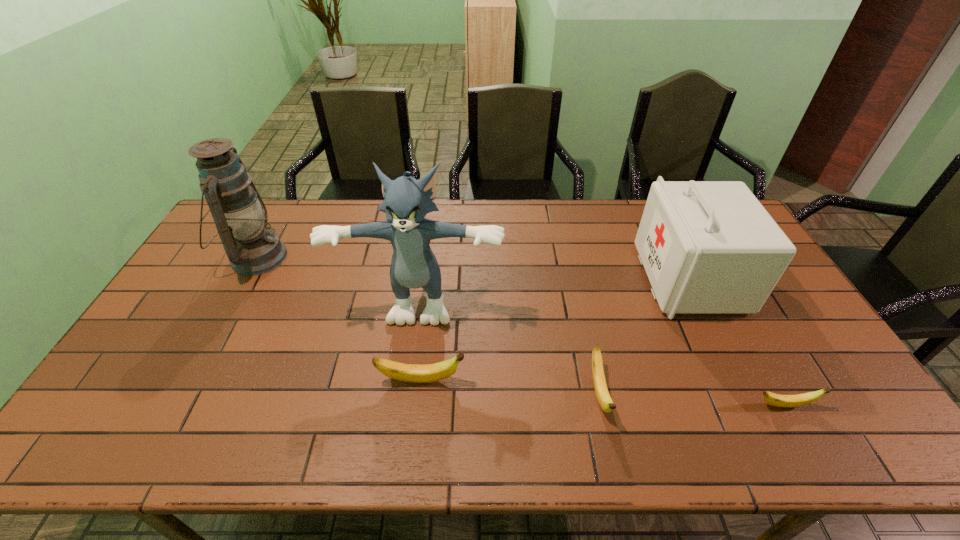
Locate an element on the screen. This screenshot has width=960, height=540. the tallest banana is located at coordinates (418, 373).

You are a GUI agent. You are given a task and a screenshot of the screen. Output one action in this format:
    pyautogui.click(x=<x>, y=<y>)
    Task: Click on the leftmost banana
    
    Given the screenshot: What is the action you would take?
    pyautogui.click(x=418, y=373)

The height and width of the screenshot is (540, 960). I want to click on the second banana from right to left, so click(x=604, y=399).

The image size is (960, 540). In order to click on the third object from right to left in this screenshot , I will do `click(604, 399)`.

Image resolution: width=960 pixels, height=540 pixels. Identify the location of the rightmost banana. (787, 401).

You are a GUI agent. You are given a task and a screenshot of the screen. Output one action in this format:
    pyautogui.click(x=<x>, y=<y>)
    Task: Click on the shortest object
    
    Given the screenshot: What is the action you would take?
    pyautogui.click(x=787, y=401)

The image size is (960, 540). What are the coordinates of `the third tallest object` in the screenshot? It's located at (708, 247).

Locate an element on the screen. This screenshot has height=540, width=960. the leftmost object is located at coordinates (240, 216).

Locate an element on the screen. This screenshot has height=540, width=960. cat is located at coordinates (407, 201).

Identify the location of vacant space situated at the stem of the leftmost banana. (485, 380).